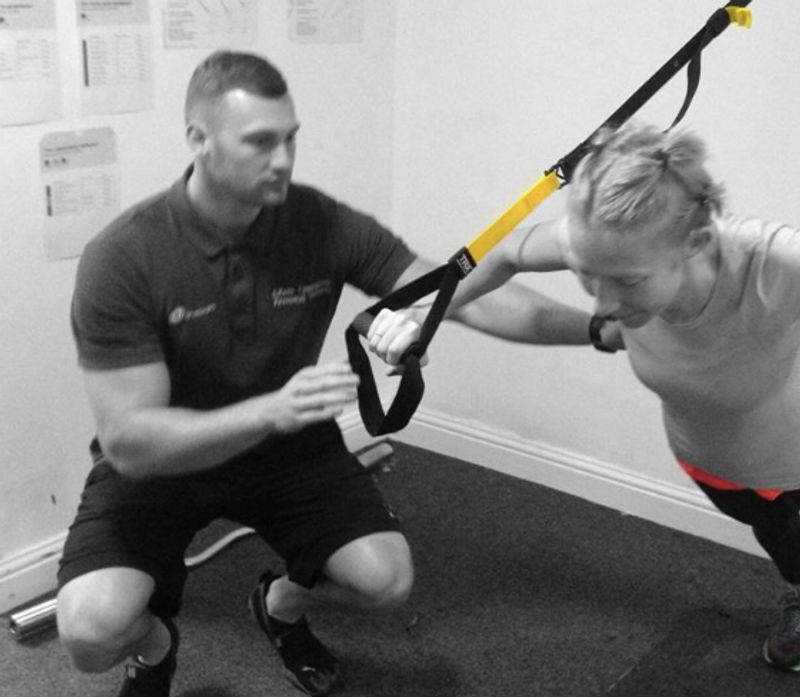
You are a GUI agent. You are given a task and a screenshot of the screen. Output one action in this format:
    pyautogui.click(x=<x>, y=<y>)
    Task: Click on the papers
    The image size is (800, 697).
    Given the screenshot: What is the action you would take?
    pyautogui.click(x=109, y=65)